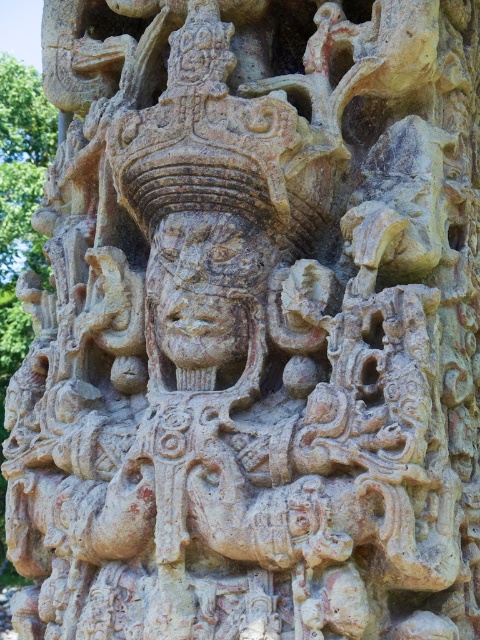
Measure the distance from carved stone face at center to green stone tree at left.

They are 1.15 meters apart.

Consider the image. Is carved stone face at center wider than green stone tree at left?

Correct, the width of carved stone face at center exceeds that of green stone tree at left.

Locate an element on the screen. This screenshot has height=640, width=480. carved stone face at center is located at coordinates (205, 285).